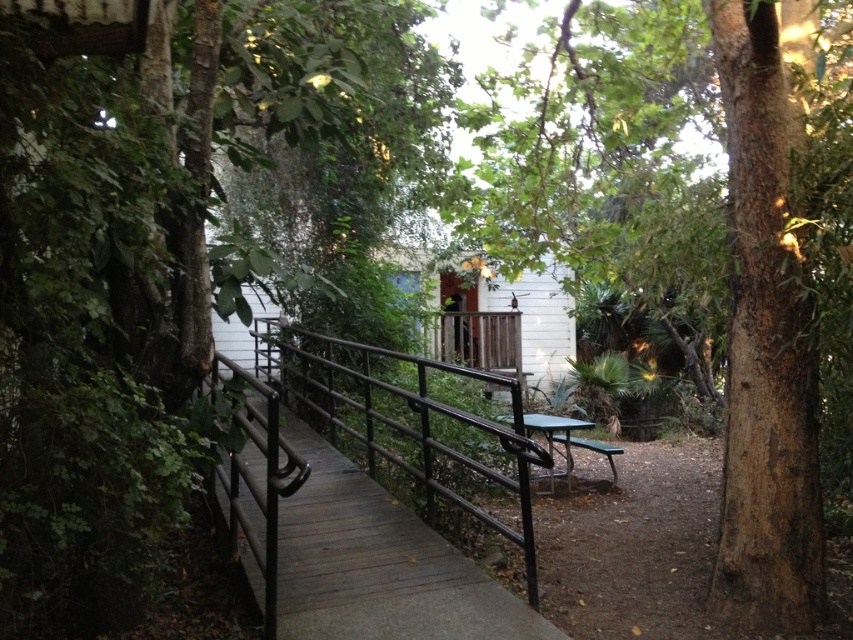
Can you confirm if black metal/rail at center is positioned to the left of green plastic picnic table at center?

Indeed, black metal/rail at center is positioned on the left side of green plastic picnic table at center.

Find the location of `black metal/rail at center`. black metal/rail at center is located at coordinates (403, 420).

Is point (421, 365) farther from camera compared to point (606, 451)?

That is False.

Where is `black metal/rail at center`? The height and width of the screenshot is (640, 853). black metal/rail at center is located at coordinates click(403, 420).

Which of these two, brown rough tree at center or black metal/rail at center, stands shorter?

brown rough tree at center

In the scene shown: Does brown rough tree at center have a greater width compared to black metal/rail at center?

No, brown rough tree at center is not wider than black metal/rail at center.

Where is `brown rough tree at center`? Image resolution: width=853 pixels, height=640 pixels. brown rough tree at center is located at coordinates (695, 230).

Find the location of a particular element. The image size is (853, 640). brown rough tree at center is located at coordinates (695, 230).

Is green leafy tree at center below green plastic picnic table at center?

Actually, green leafy tree at center is above green plastic picnic table at center.

Is point (128, 125) closer to camera compared to point (556, 449)?

That is True.

The height and width of the screenshot is (640, 853). I want to click on green leafy tree at center, so click(x=140, y=259).